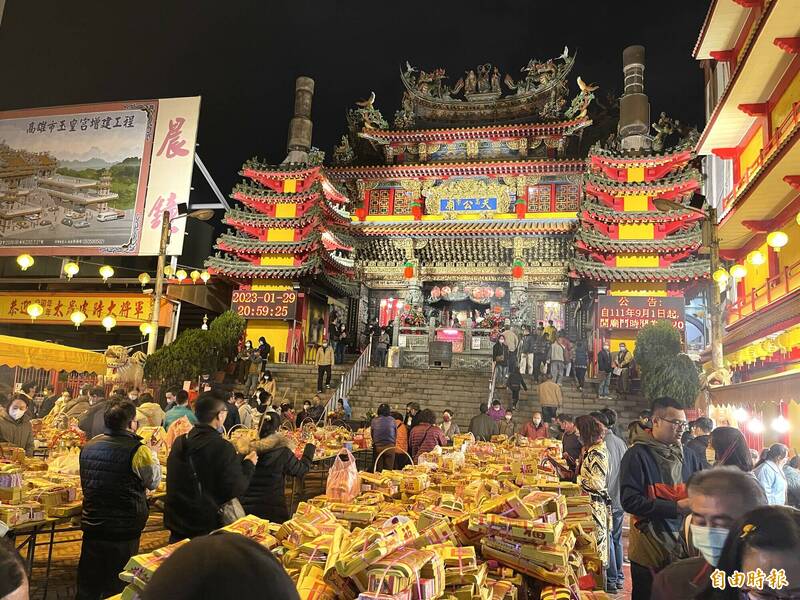
Identify the location of hanging lights. This screenshot has height=600, width=800. tap(74, 321), tap(70, 267), tap(774, 246), tap(754, 424).